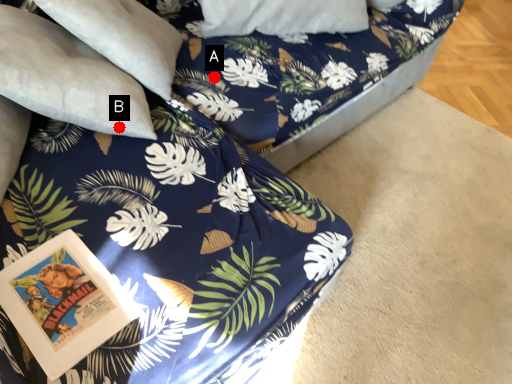
Question: Two points are circled on the image, labeled by A and B beside each circle. Which point is closer to the camera?

Choices:
 (A) A is closer
 (B) B is closer

Answer: (B)